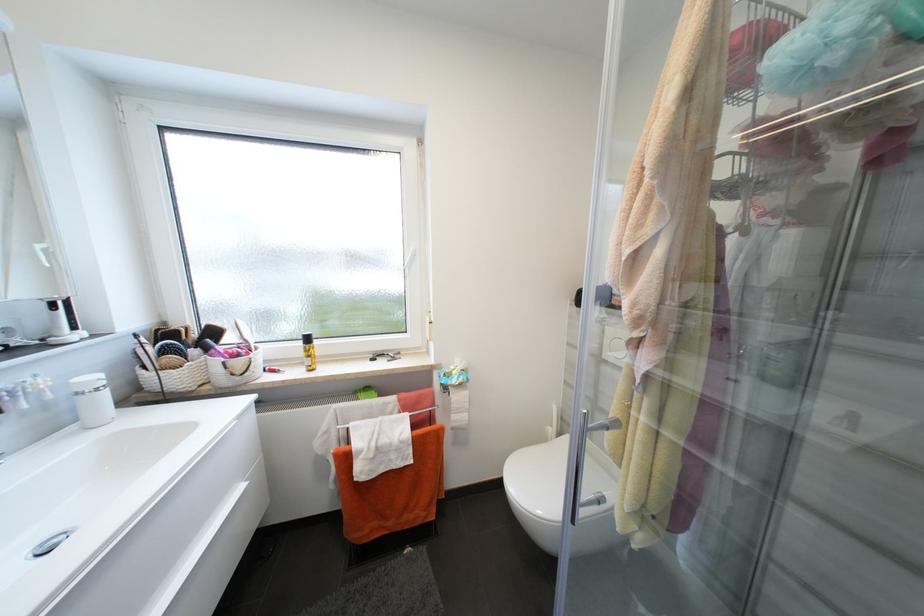
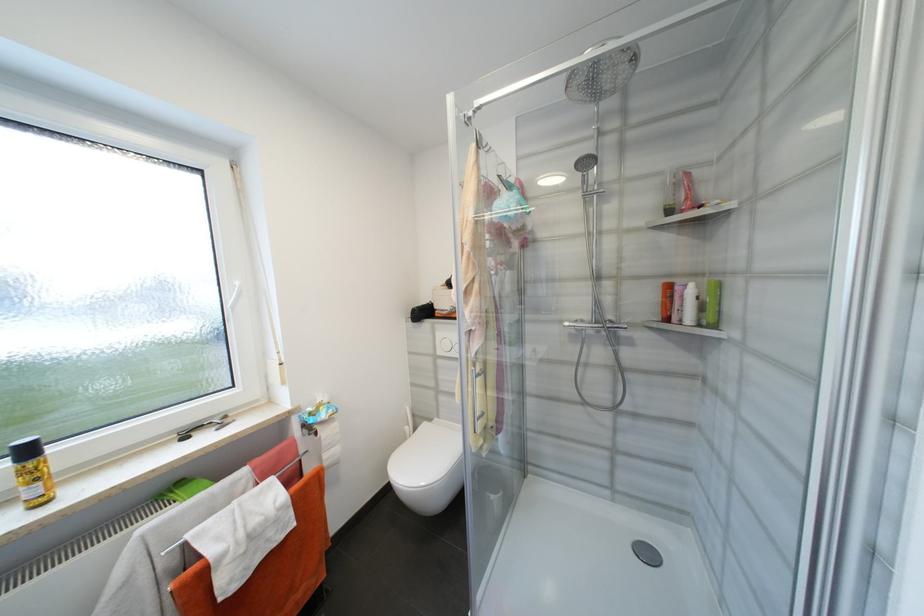
In the second image, find the point that corresponds to point (313, 341) in the first image.

(33, 453)